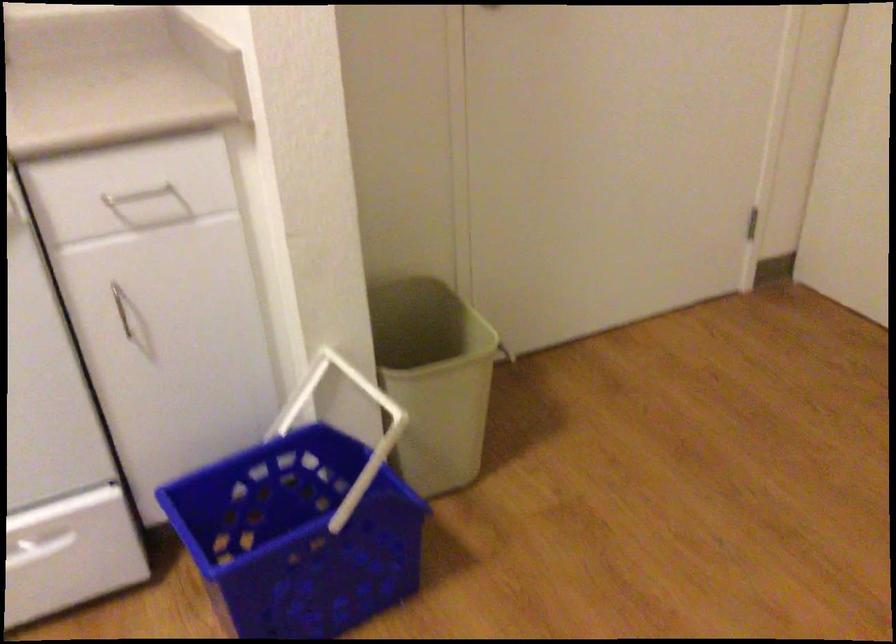
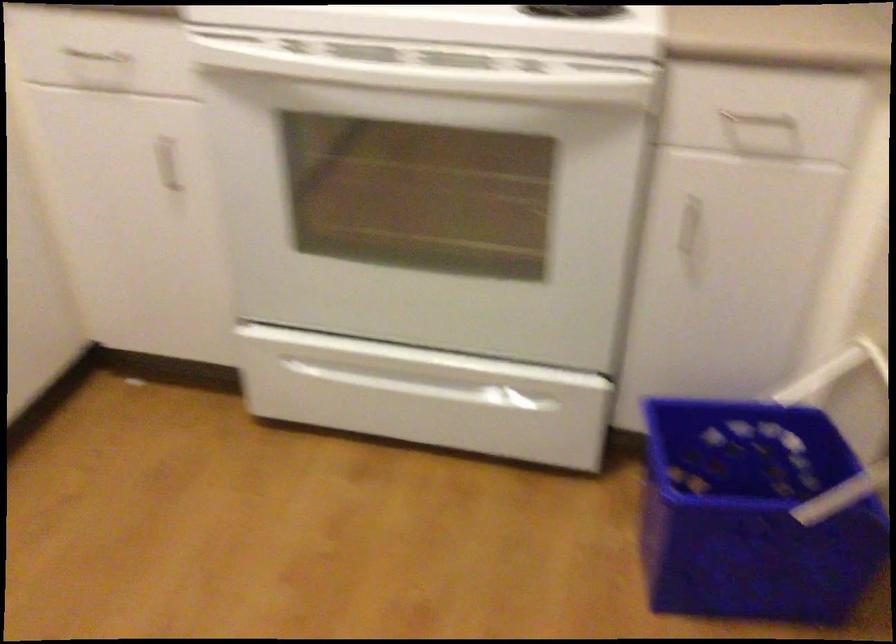
The point at (134, 314) is marked in the first image. Where is the corresponding point in the second image?

(691, 228)